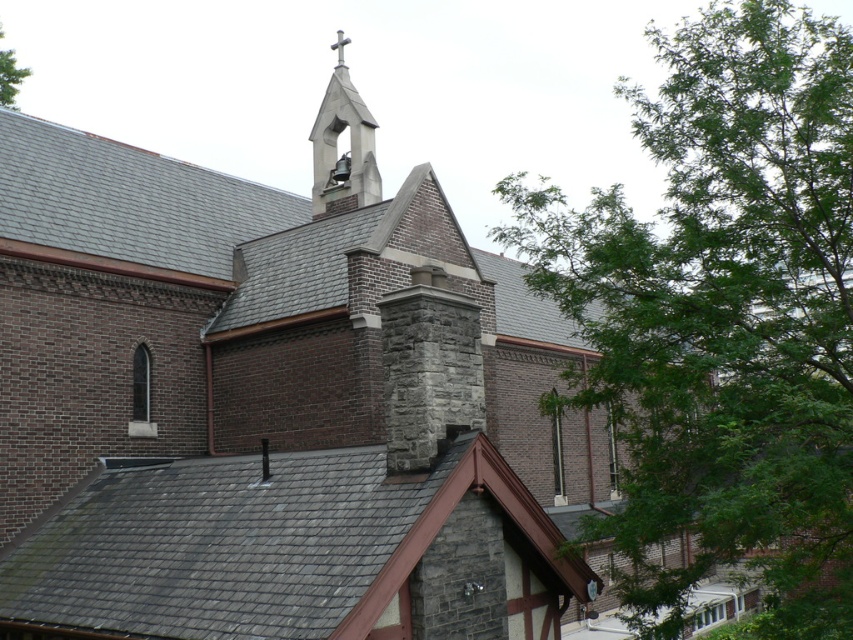
Is green leafy tree at upper right in front of green leafy tree at upper left?

Yes, green leafy tree at upper right is in front of green leafy tree at upper left.

Based on the photo, can you confirm if green leafy tree at upper right is smaller than green leafy tree at upper left?

No.

The height and width of the screenshot is (640, 853). What do you see at coordinates (723, 316) in the screenshot?
I see `green leafy tree at upper right` at bounding box center [723, 316].

Identify the location of green leafy tree at upper right. This screenshot has height=640, width=853. (723, 316).

Is white stone bell tower at upper center positioned at the back of green leafy tree at upper left?

That is False.

Which is more to the left, white stone bell tower at upper center or green leafy tree at upper left?

green leafy tree at upper left is more to the left.

I want to click on white stone bell tower at upper center, so click(335, 145).

Does green leafy tree at upper right have a smaller size compared to white stone bell tower at upper center?

No, green leafy tree at upper right is not smaller than white stone bell tower at upper center.

Is green leafy tree at upper right behind white stone bell tower at upper center?

No, it is in front of white stone bell tower at upper center.

This screenshot has width=853, height=640. I want to click on green leafy tree at upper right, so click(x=723, y=316).